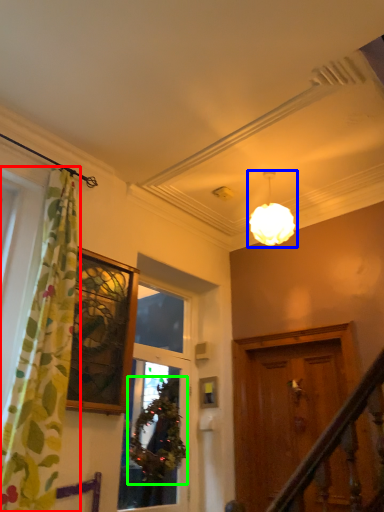
Question: Which object is the farthest from curtain (highlighted by a red box)? Choose among these: lamp (highlighted by a blue box) or plant (highlighted by a green box).

Choices:
 (A) lamp
 (B) plant

Answer: (A)